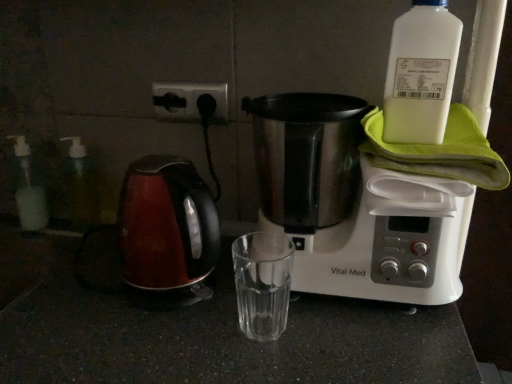
Identify the location of free space above shiny red kettle at left (from a real-world perspective). (160, 165).